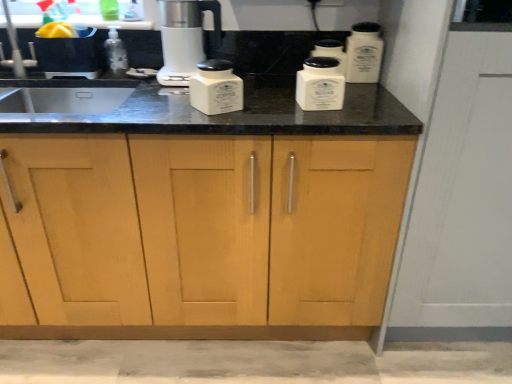
Question: Can you confirm if transparent plastic bottle at left is bigger than white ceramic container at upper right, the 1th kitchen appliance positioned from the right?

Choices:
 (A) yes
 (B) no

Answer: (B)

Question: Does transparent plastic bottle at left have a smaller size compared to white ceramic container at upper right, which ranks as the 4th kitchen appliance in left-to-right order?

Choices:
 (A) no
 (B) yes

Answer: (B)

Question: Is transparent plastic bottle at left in contact with white ceramic container at upper right, which ranks as the 4th kitchen appliance in left-to-right order?

Choices:
 (A) no
 (B) yes

Answer: (A)

Question: Considering the relative sizes of transparent plastic bottle at left and white ceramic container at upper right, which ranks as the 4th kitchen appliance in left-to-right order, in the image provided, is transparent plastic bottle at left taller than white ceramic container at upper right, which ranks as the 4th kitchen appliance in left-to-right order,?

Choices:
 (A) no
 (B) yes

Answer: (A)

Question: Considering the relative positions of transparent plastic bottle at left and white ceramic container at upper right, the 1th kitchen appliance positioned from the right, in the image provided, is transparent plastic bottle at left to the left of white ceramic container at upper right, the 1th kitchen appliance positioned from the right, from the viewer's perspective?

Choices:
 (A) yes
 (B) no

Answer: (A)

Question: Is transparent plastic bottle at left not within white ceramic container at upper right, the 1th kitchen appliance positioned from the right?

Choices:
 (A) yes
 (B) no

Answer: (A)

Question: Is white ceramic container at center, the 3th kitchen appliance from the right, thinner than white ceramic container at upper right, which ranks as the 4th kitchen appliance in left-to-right order?

Choices:
 (A) yes
 (B) no

Answer: (A)

Question: From a real-world perspective, is white ceramic container at center, which is the second kitchen appliance from left to right, over white ceramic container at upper right, which ranks as the 4th kitchen appliance in left-to-right order?

Choices:
 (A) yes
 (B) no

Answer: (B)

Question: From a real-world perspective, is white ceramic container at center, the 3th kitchen appliance from the right, under white ceramic container at upper right, which ranks as the 4th kitchen appliance in left-to-right order?

Choices:
 (A) yes
 (B) no

Answer: (A)

Question: Is white ceramic container at center, the 3th kitchen appliance from the right, shorter than white ceramic container at upper right, the 1th kitchen appliance positioned from the right?

Choices:
 (A) no
 (B) yes

Answer: (B)

Question: Can you confirm if white ceramic container at center, which is the second kitchen appliance from left to right, is bigger than white ceramic container at upper right, the 1th kitchen appliance positioned from the right?

Choices:
 (A) no
 (B) yes

Answer: (A)

Question: Does white ceramic container at center, the 3th kitchen appliance from the right, come in front of white ceramic container at upper right, the 1th kitchen appliance positioned from the right?

Choices:
 (A) yes
 (B) no

Answer: (A)

Question: Is satin white coffee maker at center with light wood cabinet at center?

Choices:
 (A) yes
 (B) no

Answer: (B)